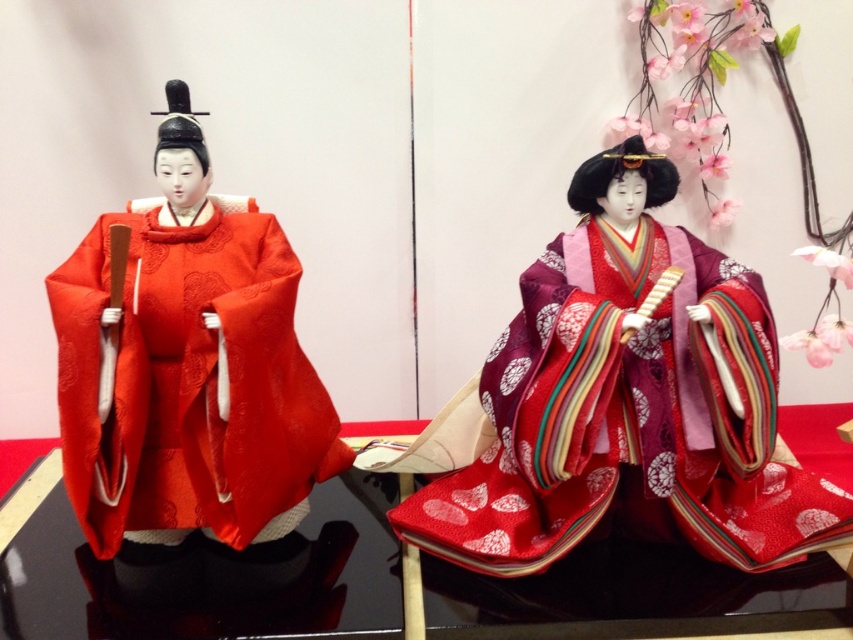
You are a photographer setting up a shoot with two dolls. You have a silky red kimono at left and a shiny black table at center. Which object is narrower in width?

The silky red kimono at left is thinner than the shiny black table at center, so the silky red kimono at left is narrower in width.

You are a photographer setting up a shoot for a traditional Japanese doll exhibition. You need to ensure that the silky red kimono at center is visible against the shiny black table at center. Based on the scene description, is the kimono positioned in a way that avoids being obscured by the table?

The silky red kimono at center is above the shiny black table at center, so it is positioned in a way that avoids being obscured by the table.